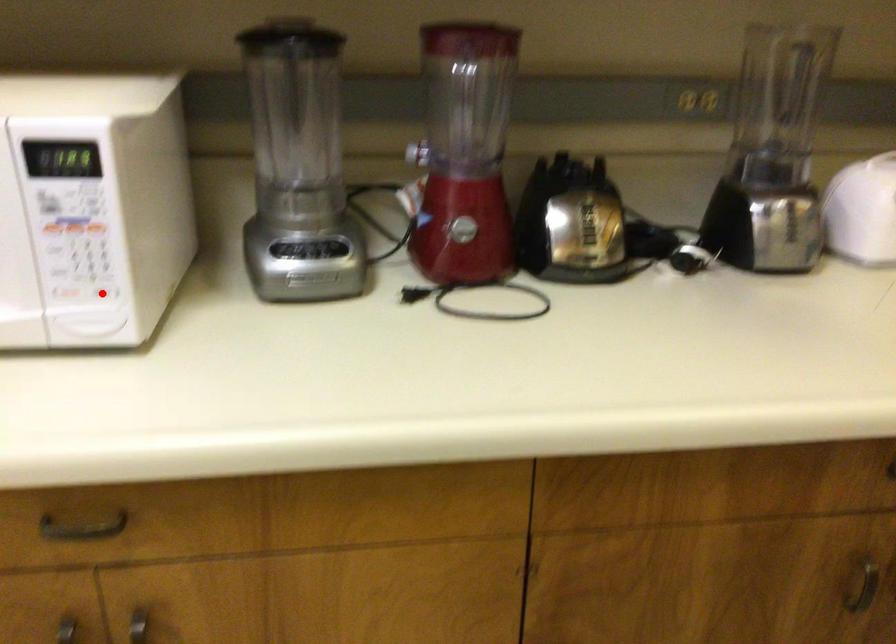
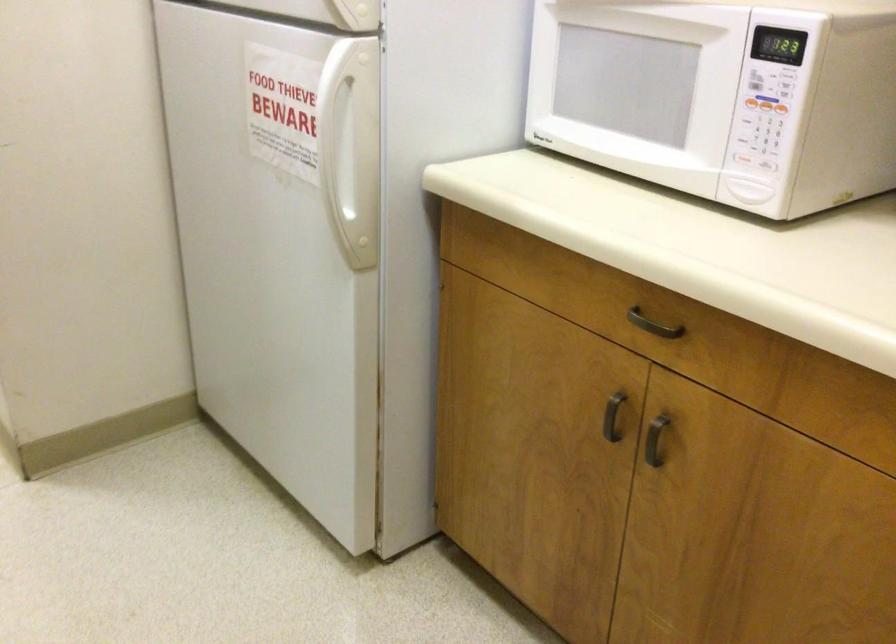
Locate, in the second image, the point that corresponds to the highlighted location in the first image.

(764, 164)